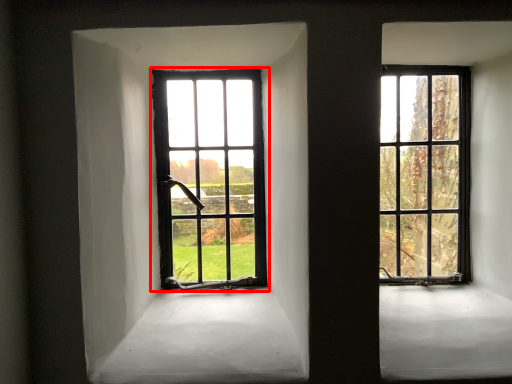
Question: From the image's perspective, what is the correct spatial relationship of window (annotated by the red box) in relation to window?

Choices:
 (A) below
 (B) above

Answer: (A)